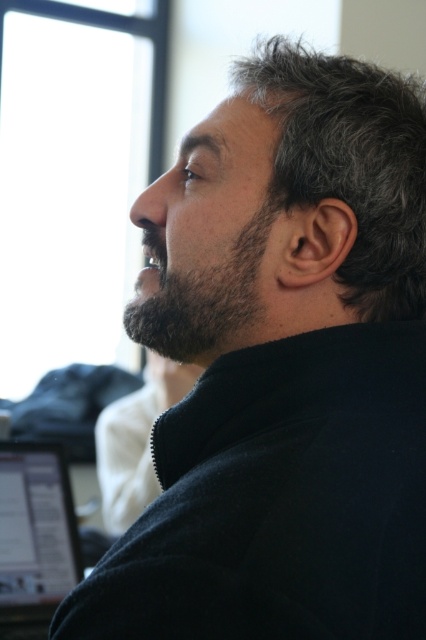
Is black glossy laptop at lower left above dark brown fuzzy beard at center?

Actually, black glossy laptop at lower left is below dark brown fuzzy beard at center.

Describe the element at coordinates (34, 538) in the screenshot. Image resolution: width=426 pixels, height=640 pixels. I see `black glossy laptop at lower left` at that location.

Is point (42, 538) behind point (226, 276)?

Yes, it is behind point (226, 276).

Locate an element on the screen. The height and width of the screenshot is (640, 426). black glossy laptop at lower left is located at coordinates (34, 538).